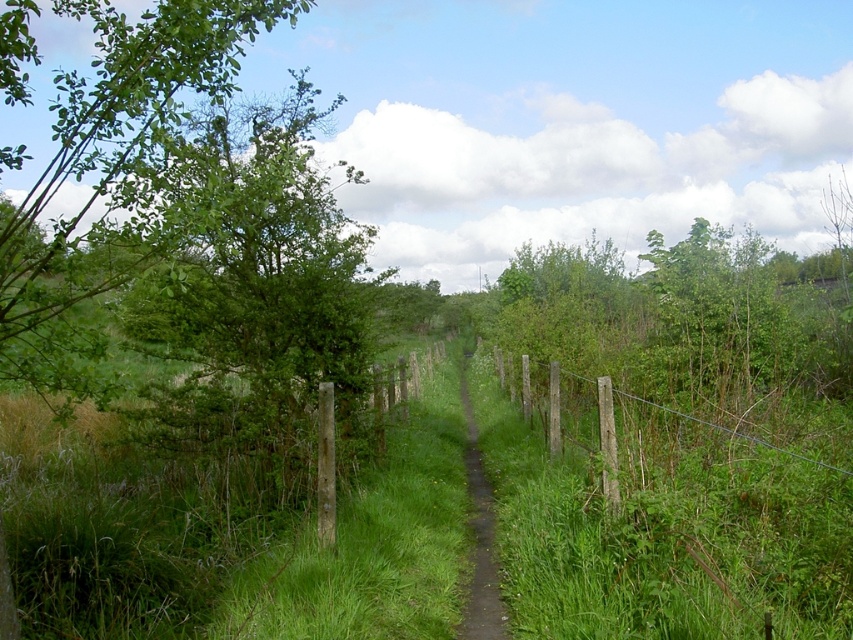
You are standing on the dirt path at center and want to take a photo of the green leafy tree at left. Which direction should you face to capture the tree in your shot?

You should face towards the left side of the dirt path at center to capture the green leafy tree at left in your photo since it is positioned to the left of the path and closer to the viewer.

You are a hiker walking along the dirt path at center. You want to take a photo of the green leafy tree at left. Which direction should you face to capture the tree in your camera?

The green leafy tree at left is located above the dirt path at center, so you should face upwards to capture the tree in your camera.

You are a hiker trying to navigate through the rural scene. You need to know which is narrower between the dirt path at center and the wooden post fence at right. Which one should you choose if you want to take the narrower route?

The dirt path at center is smaller than the wooden post fence at right, so you should choose the dirt path at center if you want to take the narrower route.